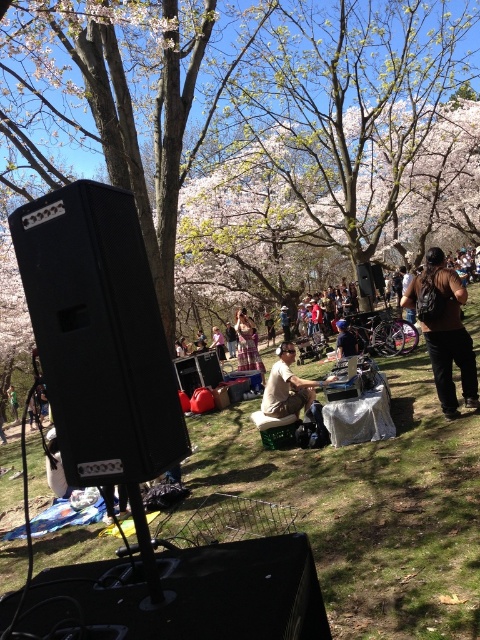
Question: Can you confirm if dark brown leather jacket at lower right is positioned above matte pink dress at center?

Choices:
 (A) no
 (B) yes

Answer: (B)

Question: Which of the following is the farthest from the observer?

Choices:
 (A) green grass at center
 (B) black matte speaker at left

Answer: (A)

Question: Is green grass at center further to the viewer compared to plaid shirt at center?

Choices:
 (A) yes
 (B) no

Answer: (B)

Question: Which object is positioned farthest from the blue denim jeans at center?

Choices:
 (A) matte pink dress at center
 (B) black matte speaker at left
 (C) plaid shirt at center

Answer: (B)

Question: Among these points, which one is farthest from the camera?

Choices:
 (A) (92, 342)
 (B) (300, 381)
 (C) (348, 326)
 (D) (213, 340)

Answer: (D)

Question: Is green grass at center below dark brown leather jacket at lower right?

Choices:
 (A) yes
 (B) no

Answer: (A)